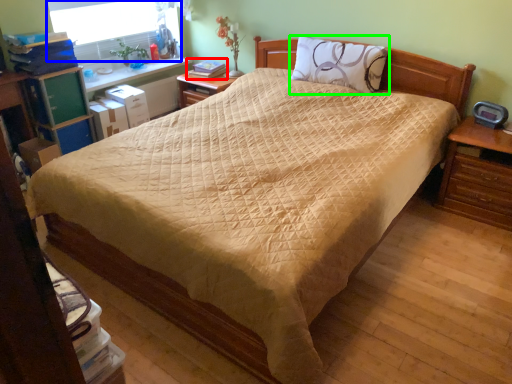
Question: Estimate the real-world distances between objects in this image. Which object is closer to book (highlighted by a red box), window screen (highlighted by a blue box) or pillow (highlighted by a green box)?

Choices:
 (A) window screen
 (B) pillow

Answer: (A)